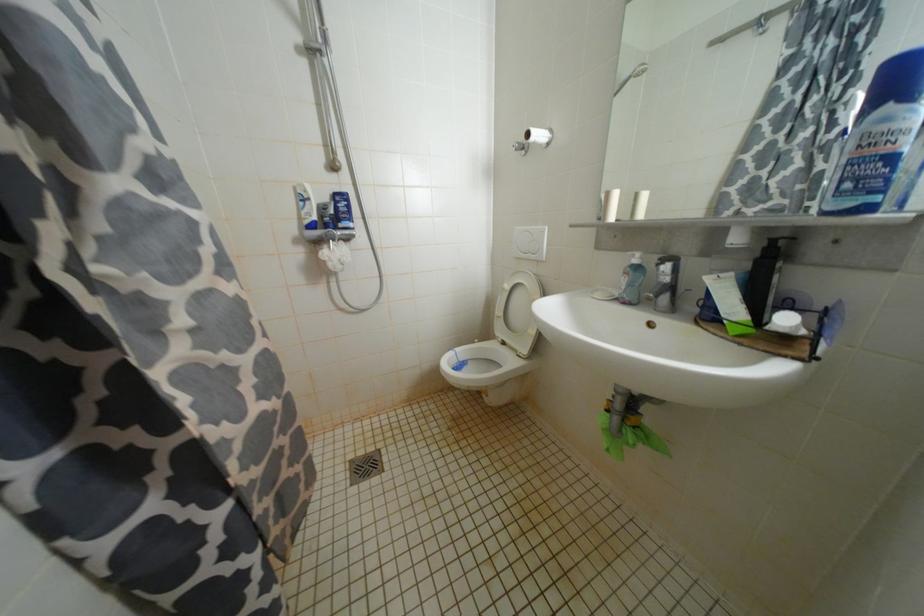
You are a GUI agent. You are given a task and a screenshot of the screen. Output one action in this format:
    pyautogui.click(x=<x>, y=<y>)
    Task: Click on the blue aerosol can
    The image size is (924, 616).
    Given the screenshot: What is the action you would take?
    pyautogui.click(x=879, y=137)